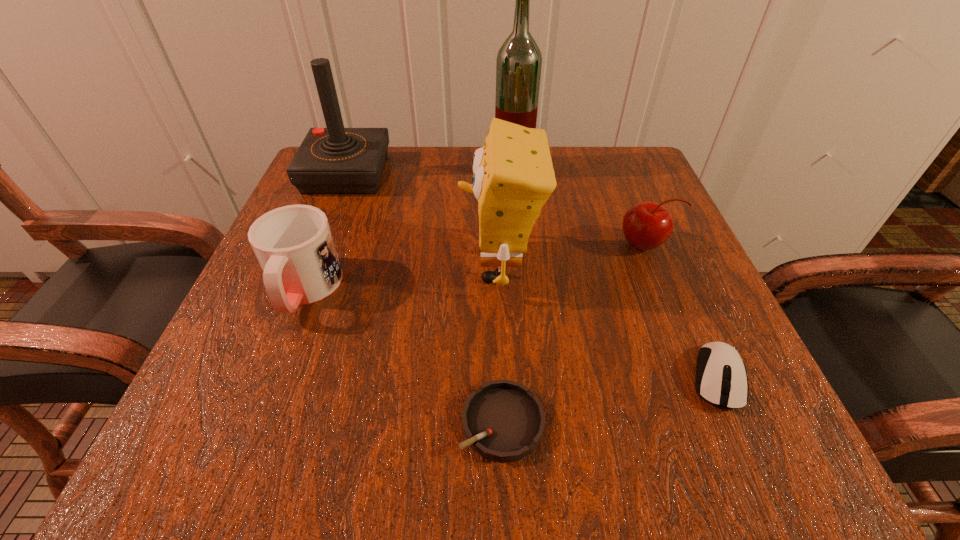
Image resolution: width=960 pixels, height=540 pixels. Identify the location of free location that satisfies the following two spatial constraints: 1. on the back side of the liquor; 2. on the left side of the shortest object. (492, 168).

Find the location of a particular element. The image size is (960, 540). vacant space that satisfies the following two spatial constraints: 1. on the rectangular base of the cherry; 2. on the right side of the joystick is located at coordinates (319, 245).

I want to click on vacant space that satisfies the following two spatial constraints: 1. on the face of the sponge; 2. on the left side of the second shortest object, so click(505, 378).

Where is `vacant area in the image that satisfies the following two spatial constraints: 1. on the rectangular base of the shortest object; 2. on the left side of the joystick`? This screenshot has width=960, height=540. vacant area in the image that satisfies the following two spatial constraints: 1. on the rectangular base of the shortest object; 2. on the left side of the joystick is located at coordinates (249, 422).

Identify the location of free spot that satisfies the following two spatial constraints: 1. on the rectangular base of the second shortest object; 2. on the right side of the joystick. Image resolution: width=960 pixels, height=540 pixels. (266, 378).

You are a GUI agent. You are given a task and a screenshot of the screen. Output one action in this format:
    pyautogui.click(x=<x>, y=<y>)
    Task: Click on the vacant region that satisfies the following two spatial constraints: 1. on the side of the mug with the handle; 2. on the left side of the ashtray
    The width and height of the screenshot is (960, 540).
    Given the screenshot: What is the action you would take?
    pyautogui.click(x=253, y=422)

Identify the location of free spot that satisfies the following two spatial constraints: 1. on the side of the shortest object with the handle; 2. on the left side of the mug. (253, 422).